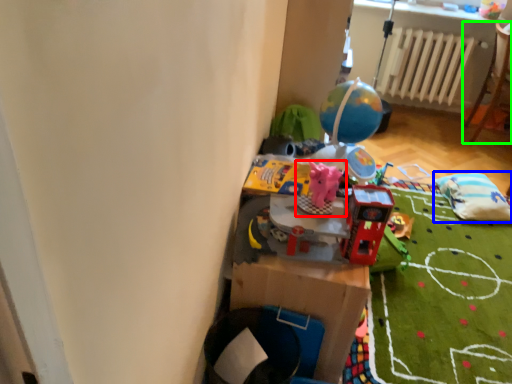
Question: Which is nearer to the toy (highlighted by a red box)? bean bag chair (highlighted by a blue box) or furniture (highlighted by a green box).

Choices:
 (A) bean bag chair
 (B) furniture

Answer: (A)